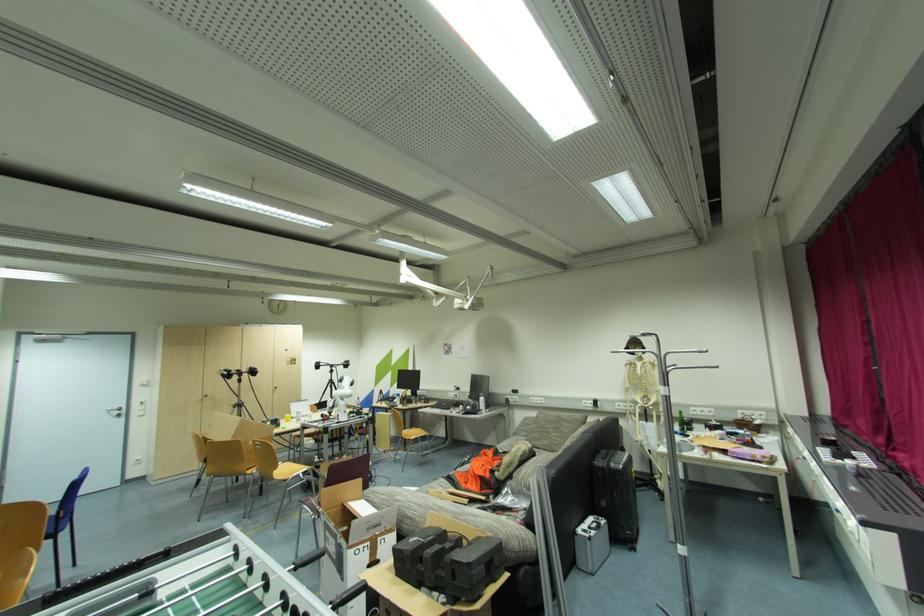
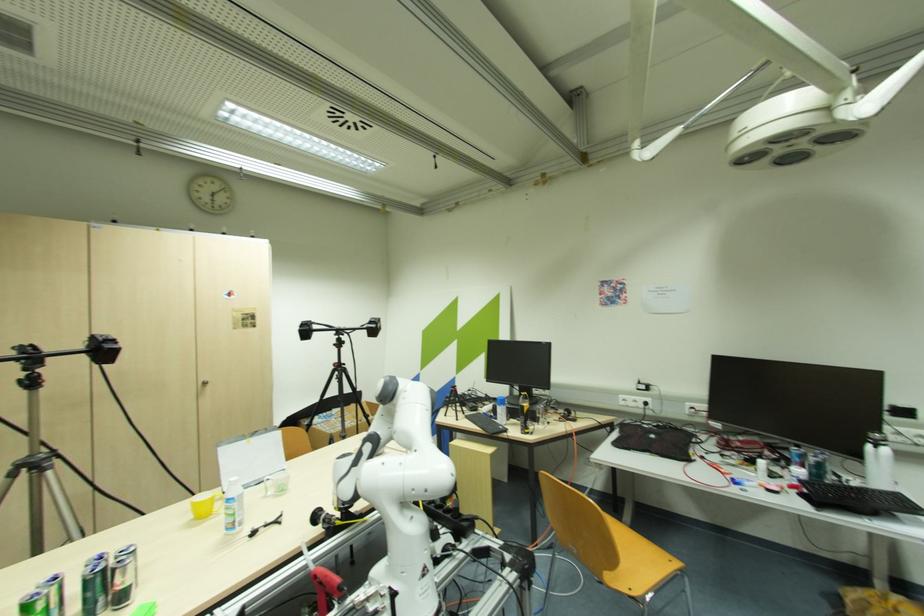
What movement of the cameraman would produce the second image?

The cameraman walked toward left, forward.